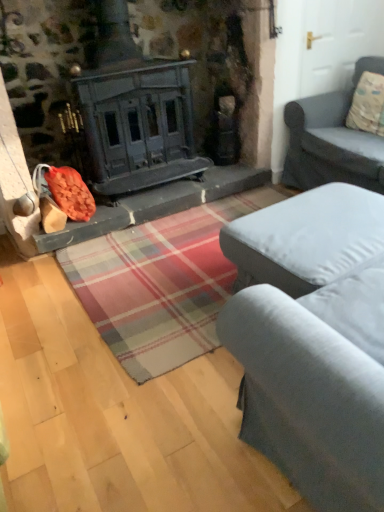
In order to click on fluffy beige pillow at upper right in this screenshot , I will do `click(368, 105)`.

How far apart are gray fabric ottoman at center, marked as the 1th studio couch in a bottom-to-top arrangement, and gray fabric couch at right, placed as the 2th studio couch when sorted from front to back?

gray fabric ottoman at center, marked as the 1th studio couch in a bottom-to-top arrangement, and gray fabric couch at right, placed as the 2th studio couch when sorted from front to back, are 3.74 feet apart from each other.

Who is taller, gray fabric ottoman at center, which is counted as the 1th studio couch, starting from the front, or gray fabric couch at right, placed as the 2th studio couch when sorted from front to back?

With more height is gray fabric couch at right, placed as the 2th studio couch when sorted from front to back.

How many degrees apart are the facing directions of gray fabric ottoman at center, the 2th studio couch positioned from the top, and gray fabric couch at right, acting as the 2th studio couch starting from the bottom?

The angular difference between gray fabric ottoman at center, the 2th studio couch positioned from the top, and gray fabric couch at right, acting as the 2th studio couch starting from the bottom, is 90.1 degrees.

Is gray fabric ottoman at center, marked as the 1th studio couch in a bottom-to-top arrangement, spatially inside gray fabric couch at right, the 1th studio couch viewed from the top, or outside of it?

The correct answer is: outside.

Does gray fabric ottoman at center, the 2th studio couch positioned from the top, have a lesser height compared to fluffy beige pillow at upper right?

No.

The width and height of the screenshot is (384, 512). I want to click on pillow behind the gray fabric ottoman at center, marked as the 1th studio couch in a bottom-to-top arrangement, so click(368, 105).

Is gray fabric ottoman at center, positioned as the second studio couch in back-to-front order, in front of or behind fluffy beige pillow at upper right in the image?

gray fabric ottoman at center, positioned as the second studio couch in back-to-front order, is positioned closer to the viewer than fluffy beige pillow at upper right.

Is fluffy beige pillow at upper right bigger than gray fabric couch at right, which is the 1th studio couch in back-to-front order?

No.

Relative to gray fabric couch at right, the 1th studio couch viewed from the top, is fluffy beige pillow at upper right in front or behind?

Clearly, fluffy beige pillow at upper right is behind gray fabric couch at right, the 1th studio couch viewed from the top.

Is the position of gray fabric couch at right, which is the 1th studio couch in back-to-front order, less distant than that of fluffy beige pillow at upper right?

That is True.

From a real-world perspective, relative to fluffy beige pillow at upper right, is gray fabric couch at right, the 1th studio couch viewed from the top, vertically above or below?

Clearly, from a real-world perspective, gray fabric couch at right, the 1th studio couch viewed from the top, is below fluffy beige pillow at upper right.

Is gray fabric couch at right, the 1th studio couch viewed from the top, spatially inside fluffy beige pillow at upper right, or outside of it?

gray fabric couch at right, the 1th studio couch viewed from the top, lies outside fluffy beige pillow at upper right.

Is fluffy beige pillow at upper right inside or outside of gray fabric ottoman at center, which is counted as the 1th studio couch, starting from the front?

fluffy beige pillow at upper right is spatially situated outside gray fabric ottoman at center, which is counted as the 1th studio couch, starting from the front.

In terms of size, does fluffy beige pillow at upper right appear bigger or smaller than gray fabric ottoman at center, the 2th studio couch positioned from the top?

fluffy beige pillow at upper right is smaller than gray fabric ottoman at center, the 2th studio couch positioned from the top.

Looking at their sizes, would you say fluffy beige pillow at upper right is wider or thinner than gray fabric ottoman at center, positioned as the second studio couch in back-to-front order?

Clearly, fluffy beige pillow at upper right has less width compared to gray fabric ottoman at center, positioned as the second studio couch in back-to-front order.

Is fluffy beige pillow at upper right positioned before gray fabric ottoman at center, positioned as the second studio couch in back-to-front order?

No, it is not.

How different are the orientations of gray fabric couch at right, acting as the 2th studio couch starting from the bottom, and gray fabric ottoman at center, marked as the 1th studio couch in a bottom-to-top arrangement, in degrees?

90.1 degrees separate the facing orientations of gray fabric couch at right, acting as the 2th studio couch starting from the bottom, and gray fabric ottoman at center, marked as the 1th studio couch in a bottom-to-top arrangement.

Is gray fabric couch at right, acting as the 2th studio couch starting from the bottom, inside or outside of gray fabric ottoman at center, positioned as the second studio couch in back-to-front order?

gray fabric couch at right, acting as the 2th studio couch starting from the bottom, lies outside gray fabric ottoman at center, positioned as the second studio couch in back-to-front order.

From a real-world perspective, does gray fabric couch at right, the 1th studio couch viewed from the top, sit lower than gray fabric ottoman at center, marked as the 1th studio couch in a bottom-to-top arrangement?

No, from a real-world perspective, gray fabric couch at right, the 1th studio couch viewed from the top, is not under gray fabric ottoman at center, marked as the 1th studio couch in a bottom-to-top arrangement.

Does gray fabric couch at right, which is the 1th studio couch in back-to-front order, appear on the right side of gray fabric ottoman at center, marked as the 1th studio couch in a bottom-to-top arrangement?

Correct, you'll find gray fabric couch at right, which is the 1th studio couch in back-to-front order, to the right of gray fabric ottoman at center, marked as the 1th studio couch in a bottom-to-top arrangement.

At what (x,y) coordinates should I click in order to perform the action: click on studio couch below the gray fabric couch at right, which is the 1th studio couch in back-to-front order (from a real-world perspective). Please return your answer as a coordinate pair (x, y). The image size is (384, 512). Looking at the image, I should click on (313, 341).

Identify the location of pillow that is on the right side of gray fabric ottoman at center, marked as the 1th studio couch in a bottom-to-top arrangement. pos(368,105).

When comparing their distances from gray fabric couch at right, placed as the 2th studio couch when sorted from front to back, does fluffy beige pillow at upper right or gray fabric ottoman at center, the 2th studio couch positioned from the top, seem closer?

fluffy beige pillow at upper right lies closer to gray fabric couch at right, placed as the 2th studio couch when sorted from front to back, than the other object.

Looking at this image, which object lies nearer to the anchor point gray fabric couch at right, acting as the 2th studio couch starting from the bottom, gray fabric ottoman at center, which is counted as the 1th studio couch, starting from the front, or fluffy beige pillow at upper right?

→ fluffy beige pillow at upper right is positioned closer to the anchor gray fabric couch at right, acting as the 2th studio couch starting from the bottom.

Which object lies nearer to the anchor point gray fabric ottoman at center, the 2th studio couch positioned from the top, fluffy beige pillow at upper right or gray fabric couch at right, placed as the 2th studio couch when sorted from front to back?

gray fabric couch at right, placed as the 2th studio couch when sorted from front to back.

Which object lies further to the anchor point fluffy beige pillow at upper right, gray fabric couch at right, which is the 1th studio couch in back-to-front order, or gray fabric ottoman at center, marked as the 1th studio couch in a bottom-to-top arrangement?

gray fabric ottoman at center, marked as the 1th studio couch in a bottom-to-top arrangement.

When comparing their distances from fluffy beige pillow at upper right, does gray fabric ottoman at center, positioned as the second studio couch in back-to-front order, or gray fabric couch at right, acting as the 2th studio couch starting from the bottom, seem closer?

gray fabric couch at right, acting as the 2th studio couch starting from the bottom, lies closer to fluffy beige pillow at upper right than the other object.

Based on their spatial positions, is gray fabric couch at right, acting as the 2th studio couch starting from the bottom, or fluffy beige pillow at upper right closer to gray fabric ottoman at center, the 2th studio couch positioned from the top?

Based on the image, gray fabric couch at right, acting as the 2th studio couch starting from the bottom, appears to be nearer to gray fabric ottoman at center, the 2th studio couch positioned from the top.

Identify the location of studio couch between gray fabric ottoman at center, the 2th studio couch positioned from the top, and fluffy beige pillow at upper right from front to back. The height and width of the screenshot is (512, 384). (332, 140).